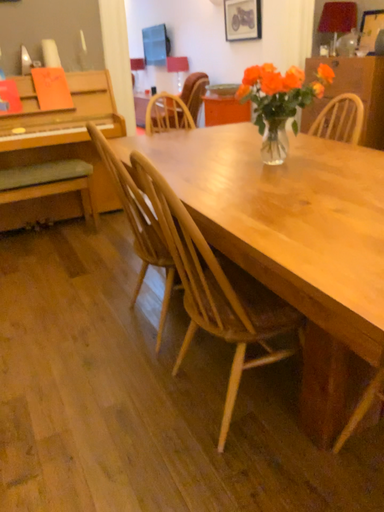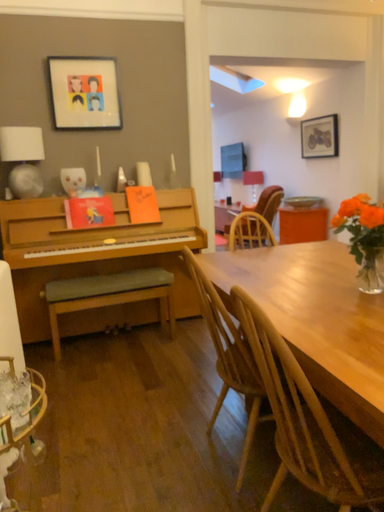
Question: Which way did the camera rotate in the video?

Choices:
 (A) rotated right
 (B) rotated left

Answer: (B)